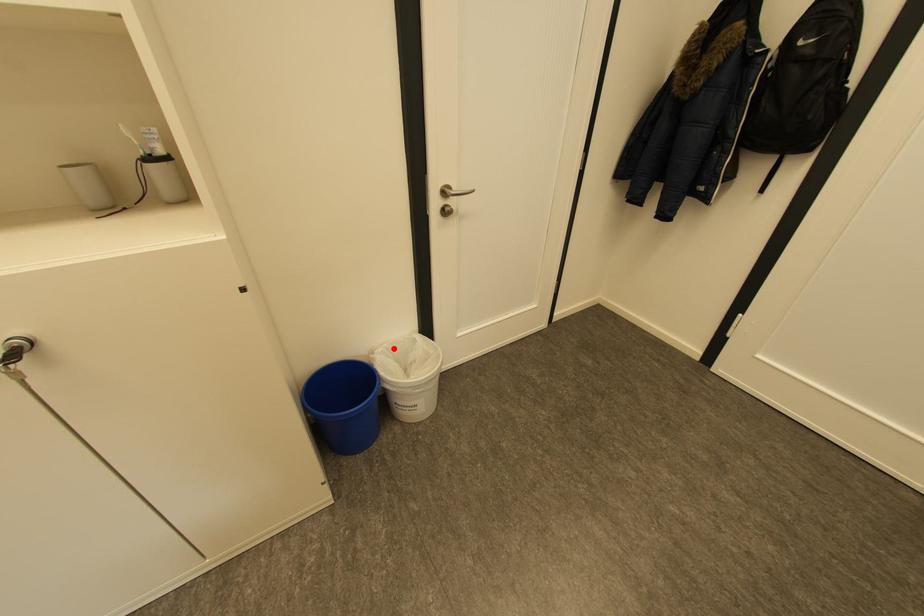
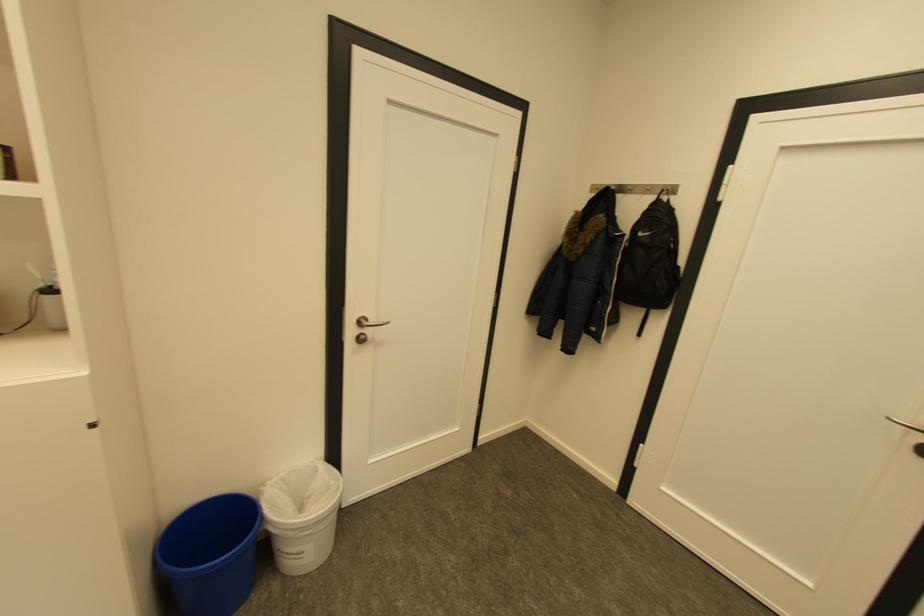
Locate, in the second image, the point that corresponds to the highlighted location in the first image.

(289, 477)